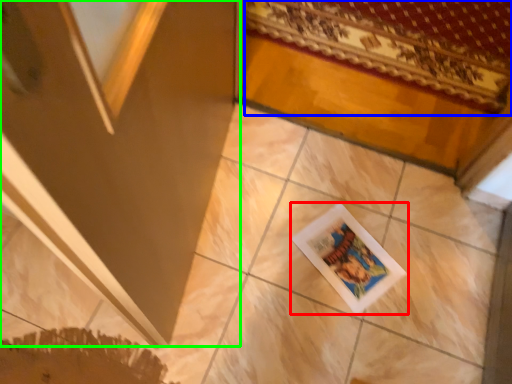
Question: Which object is positioned farthest from picture frame (highlighted by a red box)? Select from mat (highlighted by a blue box) and screen door (highlighted by a green box).

Choices:
 (A) mat
 (B) screen door

Answer: (A)